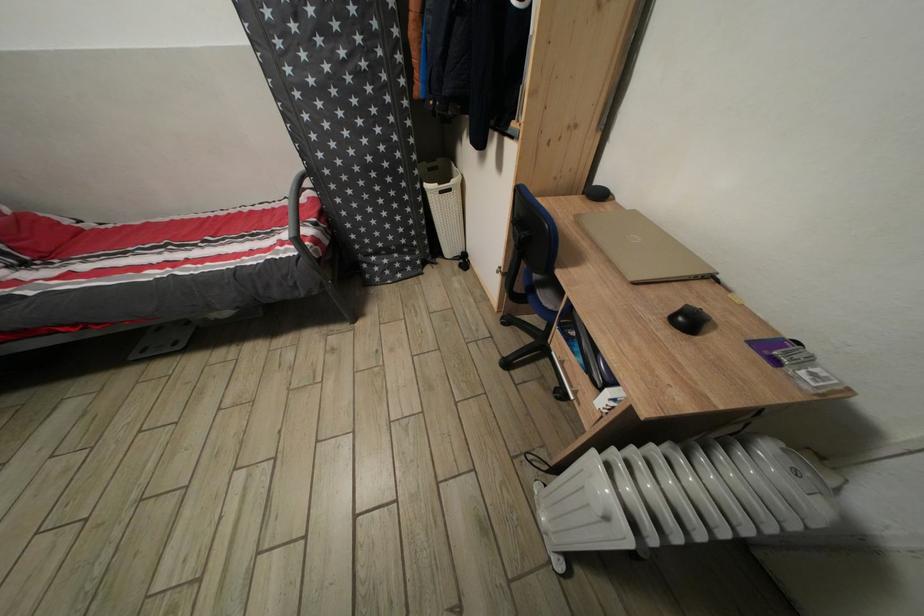
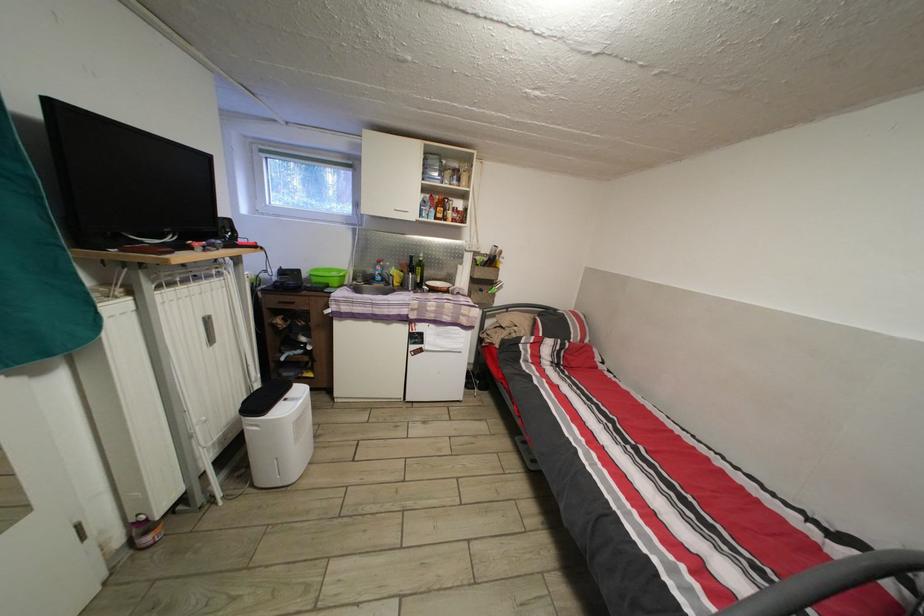
Based on the continuous images, in which direction is the camera rotating?

The rotation direction of the camera is left-down.